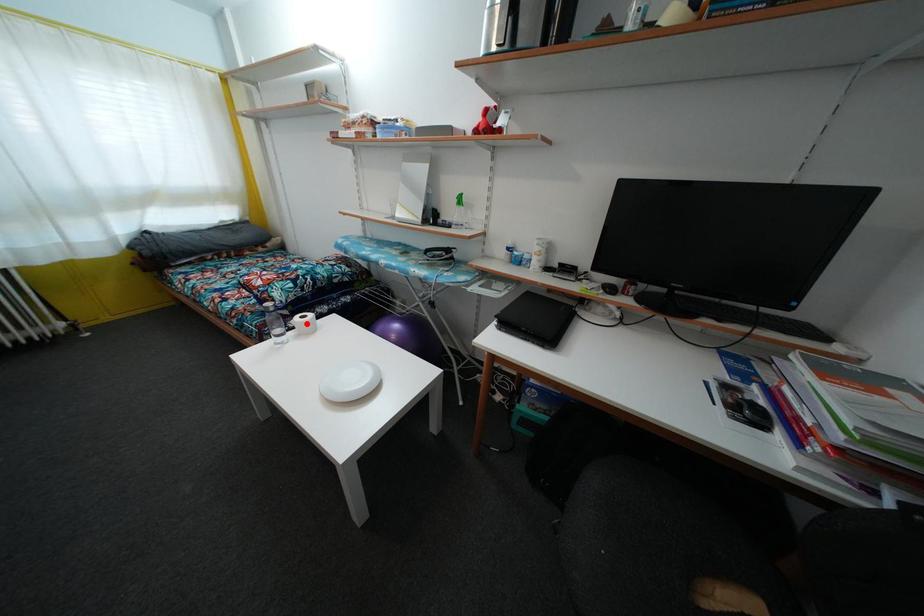
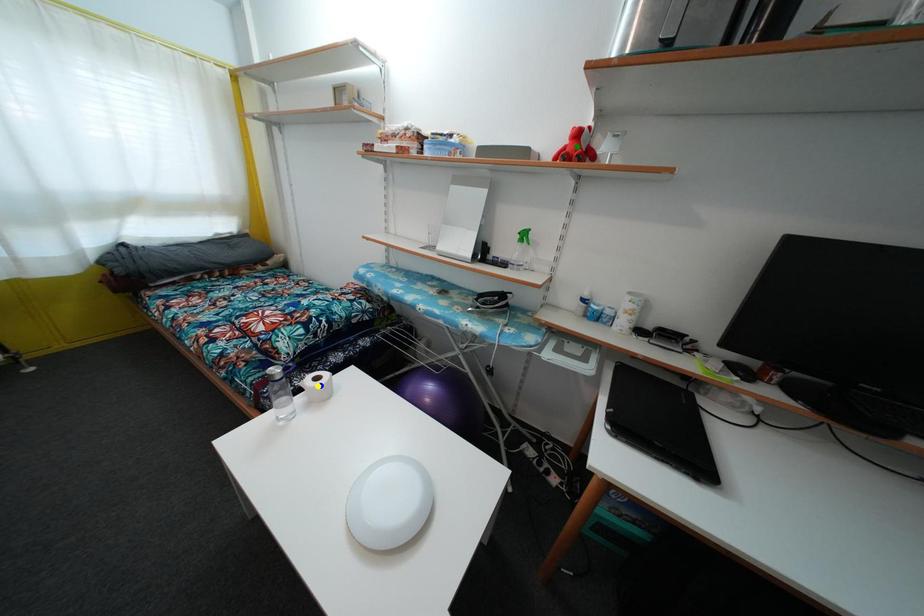
Question: I am providing you with two images of the same scene from different viewpoints. A red point is marked on the first image. You are given multiple points on the second image. Which mark in image 2 goes with the point in image 1?

Choices:
 (A) green point
 (B) blue point
 (C) yellow point

Answer: (B)